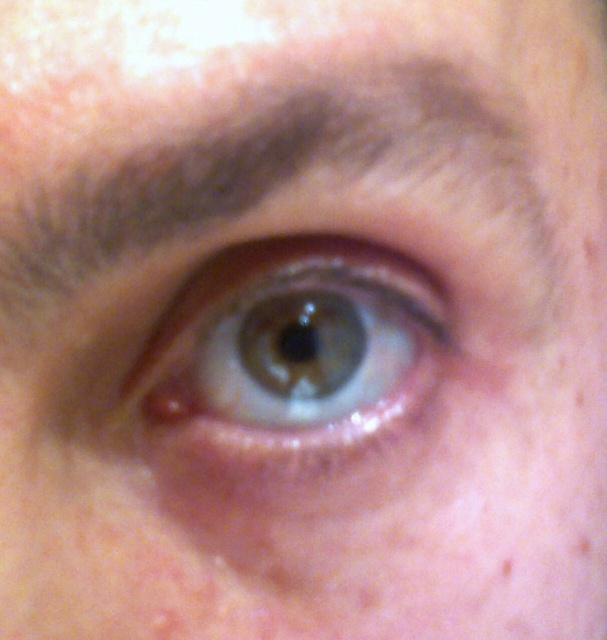
You are a makeup artist trying to apply eyeliner to the brown fuzzy eyebrow at upper center. The coordinates of the eyebrow are at point 0.269, 0.456. If the eyeliner pencil is 0.3 cm wide, will it fit within the eyebrow without going outside its boundaries?

The brown fuzzy eyebrow at upper center is located at point (x=276, y=172). Since the eyeliner pencil is 0.3 cm wide, it may not fit within the eyebrow without going outside its boundaries, as the eyebrow might be narrower than 0.3 cm. However, the exact dimensions of the eyebrow are not provided in the description, so this is an assumption.

You are a makeup artist preparing to apply eyeliner to the green matte eye at center. You need to ensure the eyeliner brush doesn not accidentally touch the brown fuzzy eyebrow at upper center. Based on their positions, can you confirm if the eyebrow is above or below the eye?

The brown fuzzy eyebrow at upper center is positioned over the green matte eye at center, meaning the eyebrow is above the eye. Therefore, the eyeliner brush should be applied carefully to avoid contact with the eyebrow located above.